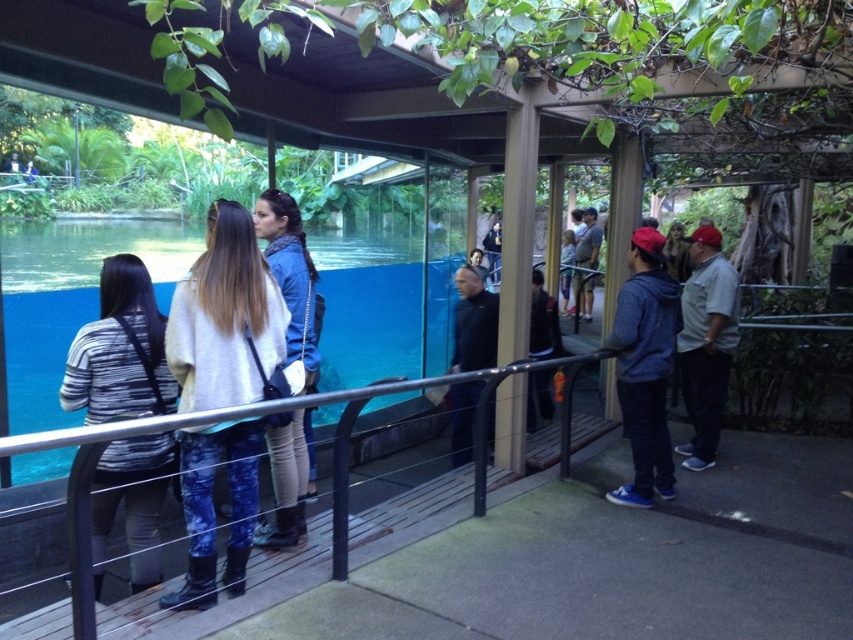
You are a tour guide leading a group on the wooden platform. You need to hand out a brochure to the person wearing the denim jacket at right and the black matte jacket at center. Which person should you approach first to ensure you reach them without walking past the other?

You should approach the denim jacket at right first because it is closer to the viewer than the black matte jacket at center, so you can reach them without passing the other person.

You are a tour guide explaining the view to your group. You need to point out the striped sweater at left and the matte gray shirt at center. Which one is positioned more to the left side of the group?

The striped sweater at left is positioned more to the left side of the group than the matte gray shirt at center.